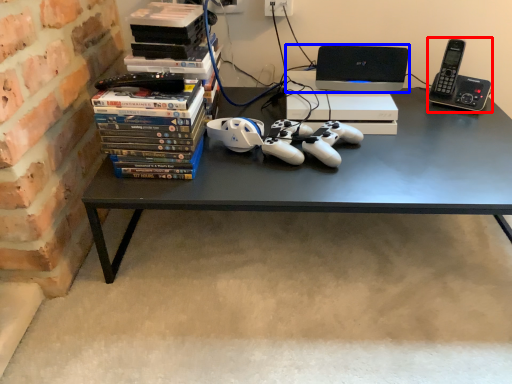
Question: Which object is further to the camera taking this photo, gadget (highlighted by a red box) or computer (highlighted by a blue box)?

Choices:
 (A) gadget
 (B) computer

Answer: (B)